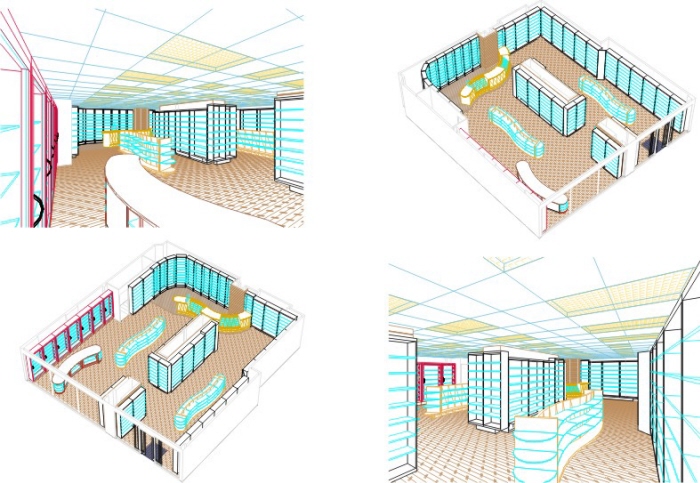
Where is `large shelving unit`? large shelving unit is located at coordinates (197, 362).